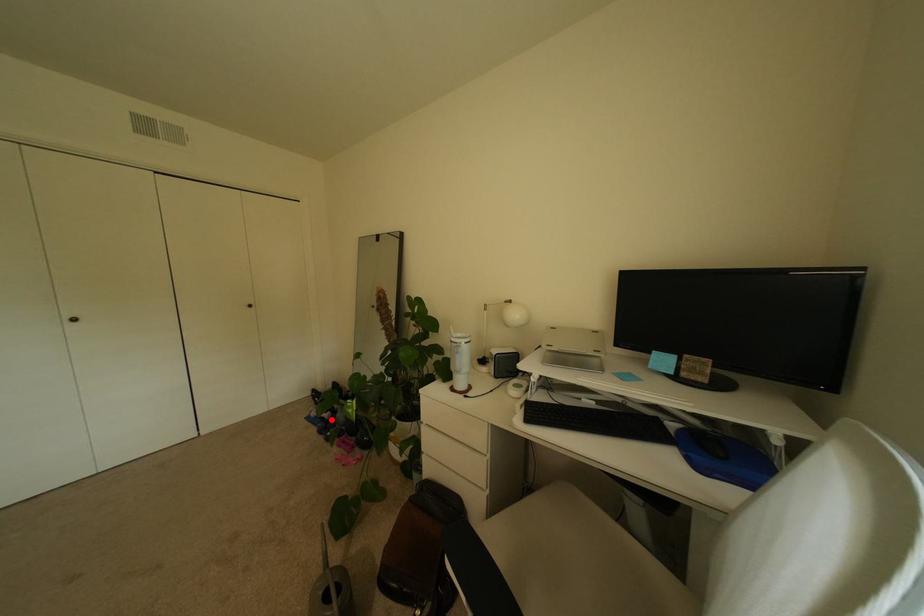
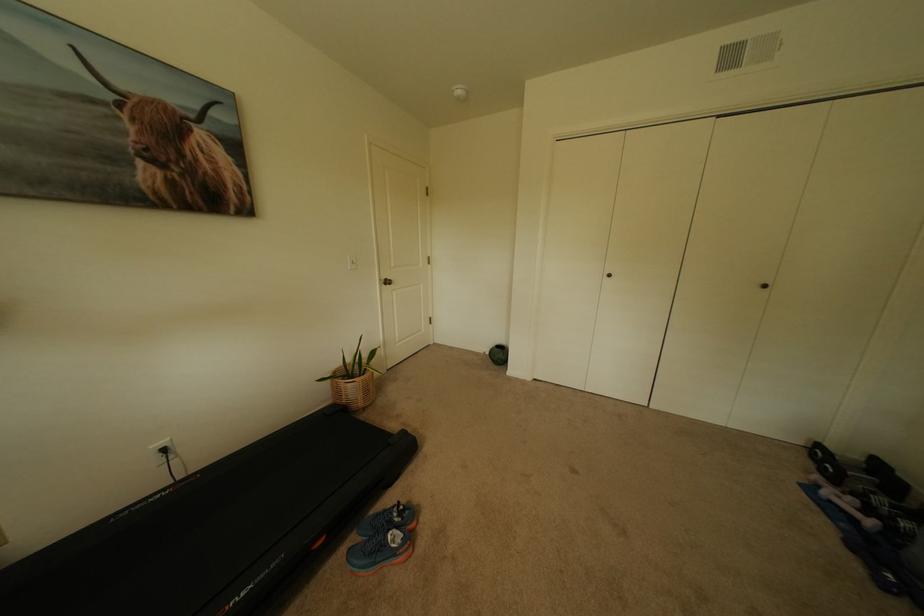
The point at the highlighted location is marked in the first image. Where is the corresponding point in the second image?

(862, 521)